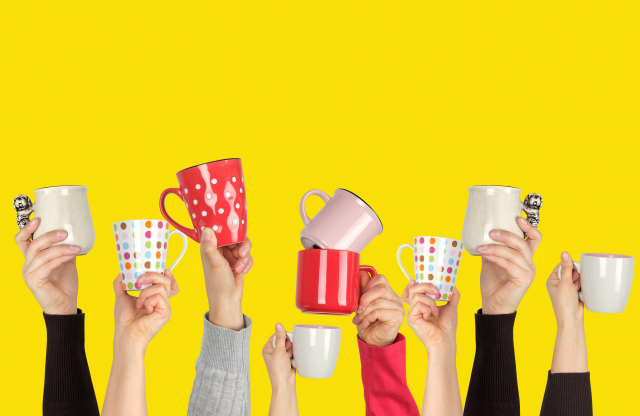
At what (x,y) coordinates should I click in order to perform the action: click on mug. Please return your answer as a coordinate pair (x, y). The height and width of the screenshot is (416, 640). Looking at the image, I should click on (66, 209), (140, 243), (220, 197), (315, 349), (322, 278), (340, 216), (445, 257), (497, 198), (608, 274).